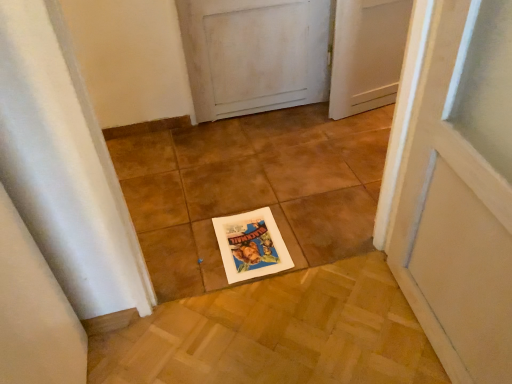
The image size is (512, 384). Describe the element at coordinates (251, 245) in the screenshot. I see `white paper postcard at center` at that location.

This screenshot has height=384, width=512. In order to click on white paper postcard at center in this screenshot , I will do `click(251, 245)`.

Describe the element at coordinates (252, 188) in the screenshot. The width and height of the screenshot is (512, 384). I see `brown tile at center` at that location.

Where is `brown tile at center`? This screenshot has height=384, width=512. brown tile at center is located at coordinates click(252, 188).

At what (x,y) coordinates should I click in order to perform the action: click on white paper postcard at center. Please return your answer as a coordinate pair (x, y). The height and width of the screenshot is (384, 512). Looking at the image, I should click on (251, 245).

Can you confirm if white paper postcard at center is positioned to the right of brown tile at center?

No, white paper postcard at center is not to the right of brown tile at center.

Is white paper postcard at center further to camera compared to brown tile at center?

Yes.

Between point (238, 235) and point (336, 217), which one is positioned behind?

The point (336, 217) is farther.

From the image's perspective, which one is positioned lower, white paper postcard at center or brown tile at center?

white paper postcard at center is shown below in the image.

From a real-world perspective, does white paper postcard at center sit lower than brown tile at center?

Yes, from a real-world perspective, white paper postcard at center is below brown tile at center.

Which object is wider, white paper postcard at center or brown tile at center?

Wider between the two is white paper postcard at center.

Consider the image. Between white paper postcard at center and brown tile at center, which one has less height?

white paper postcard at center is shorter.

Can you confirm if white paper postcard at center is bigger than brown tile at center?

Incorrect, white paper postcard at center is not larger than brown tile at center.

Is white paper postcard at center surrounding brown tile at center?

No, brown tile at center is located outside of white paper postcard at center.

Are white paper postcard at center and brown tile at center beside each other?

No.

Is white paper postcard at center aimed at brown tile at center?

No, white paper postcard at center is not aimed at brown tile at center.

How many degrees apart are the facing directions of white paper postcard at center and brown tile at center?

They differ by 179 degrees in their facing directions.

Find the location of a particular element. The width and height of the screenshot is (512, 384). postcard on the left of the brown tile at center is located at coordinates (251, 245).

Based on the photo, based on their positions, is brown tile at center located to the left or right of white paper postcard at center?

Based on their positions, brown tile at center is located to the right of white paper postcard at center.

Considering the positions of objects brown tile at center and white paper postcard at center in the image provided, who is in front, brown tile at center or white paper postcard at center?

brown tile at center.

Which is in front, point (253, 185) or point (247, 216)?

Positioned in front is point (247, 216).

From the image's perspective, between brown tile at center and white paper postcard at center, who is located below?

white paper postcard at center appears lower in the image.

From a real-world perspective, which is physically above, brown tile at center or white paper postcard at center?

In real-world perspective, brown tile at center is above.

Considering the relative sizes of brown tile at center and white paper postcard at center in the image provided, is brown tile at center thinner than white paper postcard at center?

Correct, the width of brown tile at center is less than that of white paper postcard at center.

Considering the sizes of objects brown tile at center and white paper postcard at center in the image provided, who is taller, brown tile at center or white paper postcard at center?

brown tile at center.

Can you confirm if brown tile at center is smaller than white paper postcard at center?

Incorrect, brown tile at center is not smaller in size than white paper postcard at center.

Is brown tile at center located outside white paper postcard at center?

Yes, brown tile at center is not within white paper postcard at center.

Is brown tile at center positioned far away from white paper postcard at center?

brown tile at center is actually quite close to white paper postcard at center.

Is brown tile at center oriented towards white paper postcard at center?

No, brown tile at center is not turned towards white paper postcard at center.

How distant is brown tile at center from white paper postcard at center?

brown tile at center and white paper postcard at center are 11.03 inches apart.

Image resolution: width=512 pixels, height=384 pixels. There is a white paper postcard at center. Find the location of `tile above it (from a real-world perspective)`. tile above it (from a real-world perspective) is located at coordinates (252, 188).

Where is `tile above the white paper postcard at center (from the image's perspective)`? This screenshot has height=384, width=512. tile above the white paper postcard at center (from the image's perspective) is located at coordinates (252, 188).

Where is `postcard behind the brown tile at center`? postcard behind the brown tile at center is located at coordinates (251, 245).